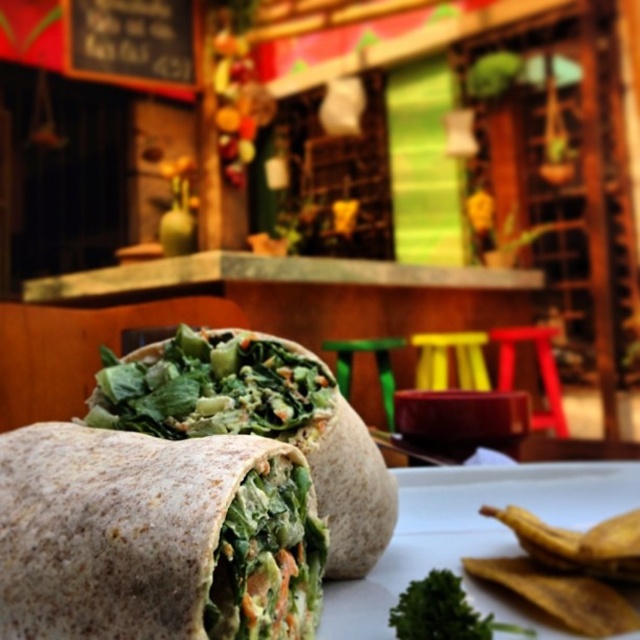
Looking at the scene, you see a whole wheat wrap at center and a green leafy burrito at center. Which one is positioned to the left?

The whole wheat wrap at center is to the left of the green leafy burrito at center.

You are at a picnic and see the whole wheat wrap at center and the green leafy burrito at center on the table. Which one is closer to you?

The whole wheat wrap at center is closer to you because it is in front of the green leafy burrito at center.

From the picture: You are a food critic inspecting a plate with both the whole wheat wrap at center and the green leafy burrito at center. Which of these two items has a smaller vertical size?

The whole wheat wrap at center has a lesser height compared to the green leafy burrito at center, so the whole wheat wrap at center is the one with the smaller vertical size.